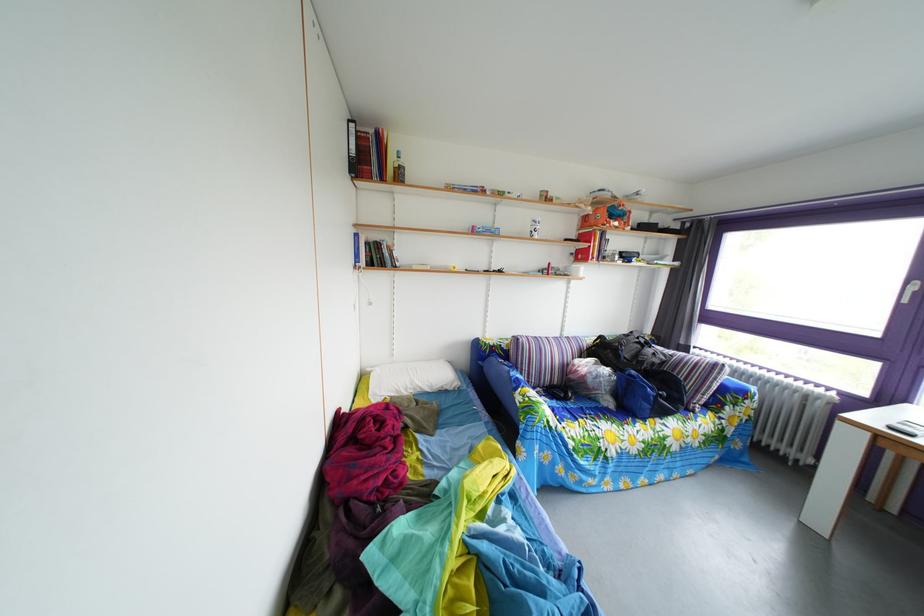
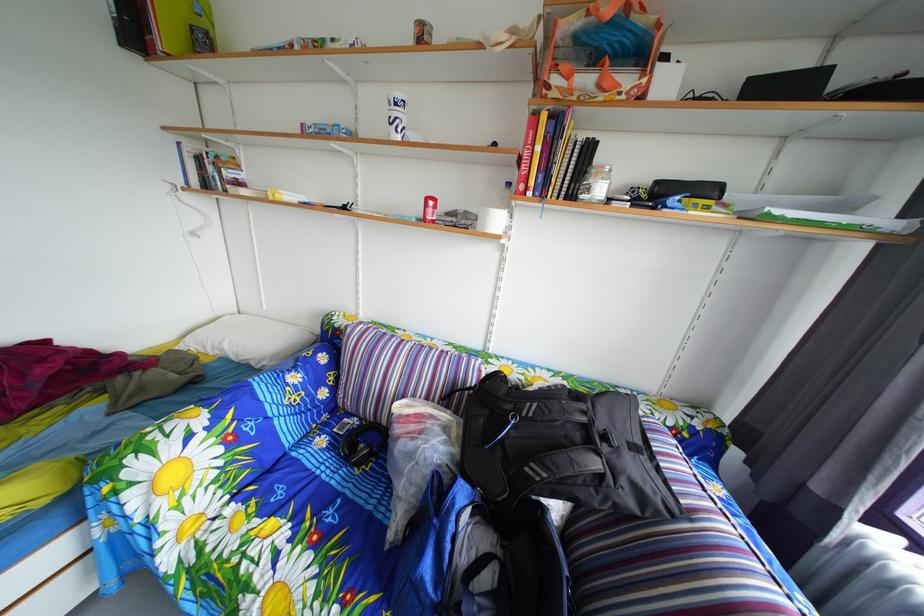
Where in the second image is the point corresponding to point 417,398 from the first image?

(224, 357)